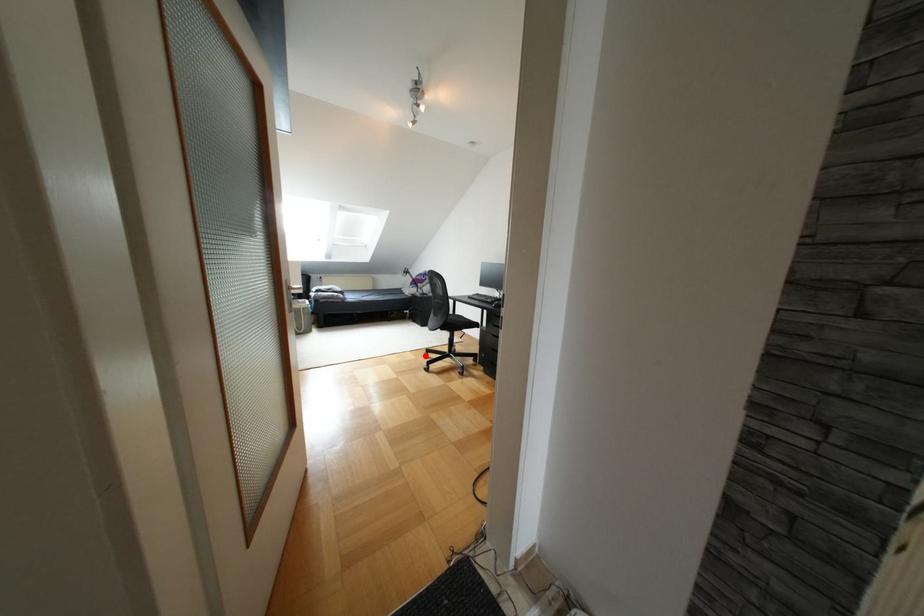
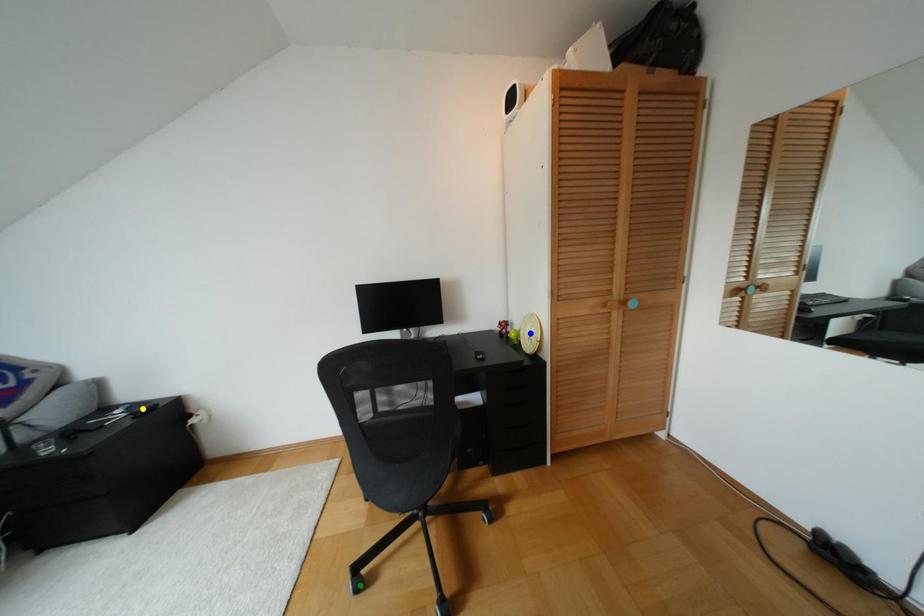
Question: I am providing you with two images of the same scene from different viewpoints. A red point is marked on the first image. You are given multiple points on the second image. Which point in image 2 represents the same 3d spot as the red point in image 1?

Choices:
 (A) green point
 (B) yellow point
 (C) blue point

Answer: (A)